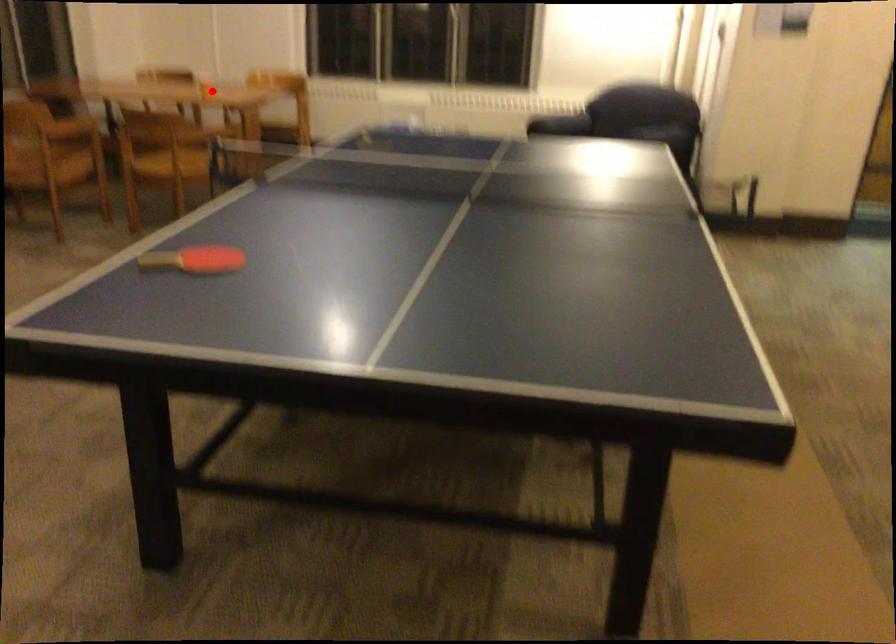
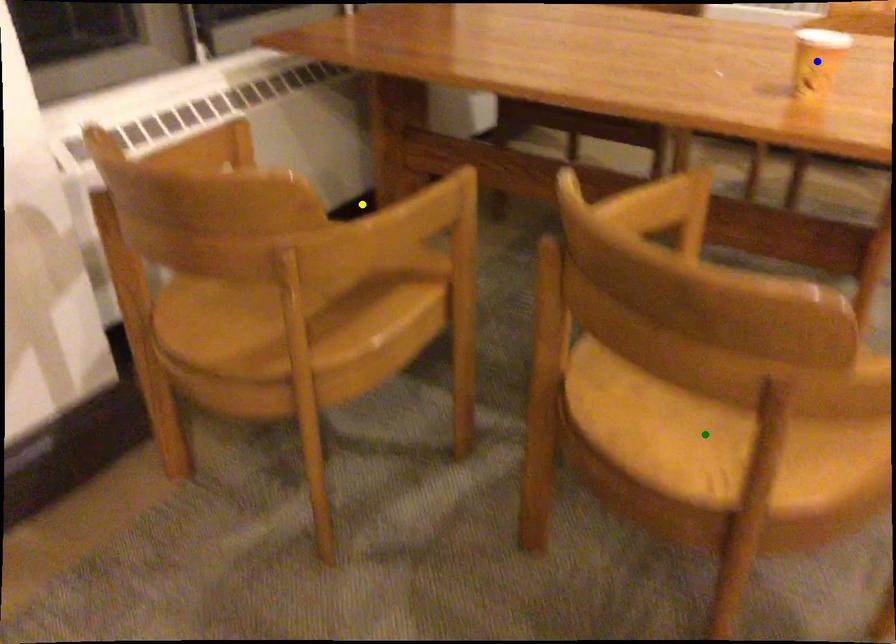
Question: I am providing you with two images of the same scene from different viewpoints. A red point is marked on the first image. You are given multiple points on the second image. In image 2, which mark is for the same physical point as the one in image 1?

Choices:
 (A) blue point
 (B) green point
 (C) yellow point

Answer: (A)